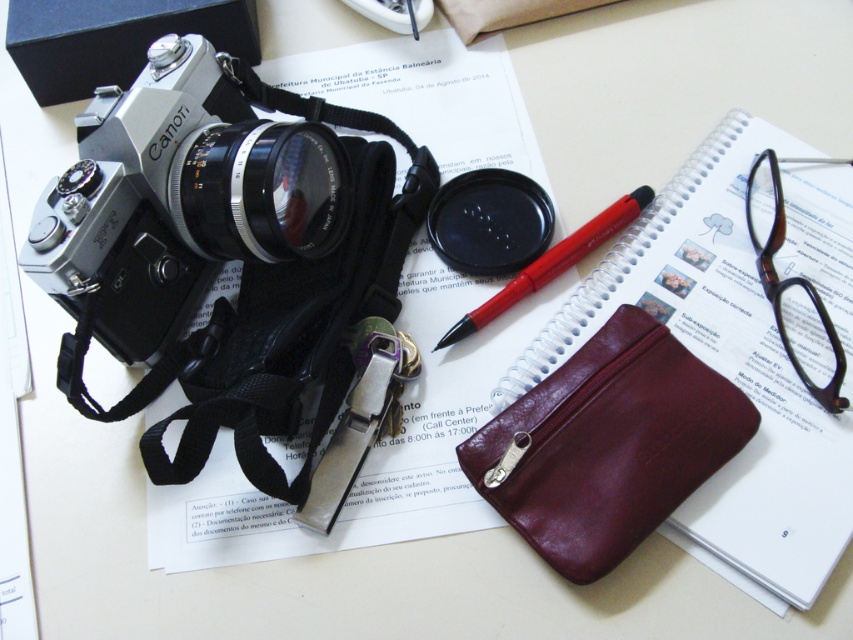
You are looking at the image and want to determine which of the two points, point (248, 166) or point (614, 208), is nearer to you. Based on the scene, which point is closer?

Point (248, 166) is closer to the viewer than point (614, 208).

You are organizing items on the desk and need to place a new item between the burgundy leather pouch at center and the metallic silver key at center. Which item should be placed closer to you to maintain the existing arrangement?

To maintain the existing arrangement, the new item should be placed closer to the burgundy leather pouch at center since it is already closer to the viewer than the metallic silver key at center.

You are organizing items on a desk and need to place a new item between the burgundy leather pouch at center and the metallic silver key at center. Based on their current positions, which item should you place the new item closer to?

The new item should be placed closer to the metallic silver key at center because the burgundy leather pouch at center is located below it, meaning the key is positioned higher up on the desk.